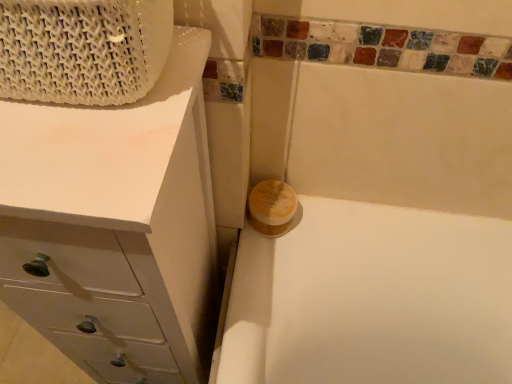
Question: Does yellow matte soap at center contain white woven basket at upper left?

Choices:
 (A) no
 (B) yes

Answer: (A)

Question: Is yellow matte soap at center positioned with its back to white woven basket at upper left?

Choices:
 (A) yes
 (B) no

Answer: (B)

Question: Is the depth of yellow matte soap at center greater than that of white woven basket at upper left?

Choices:
 (A) no
 (B) yes

Answer: (B)

Question: Is yellow matte soap at center thinner than white woven basket at upper left?

Choices:
 (A) yes
 (B) no

Answer: (A)

Question: Is yellow matte soap at center far away from white woven basket at upper left?

Choices:
 (A) no
 (B) yes

Answer: (A)

Question: Is white woven basket at upper left in front of or behind yellow matte soap at center in the image?

Choices:
 (A) front
 (B) behind

Answer: (A)

Question: From their relative heights in the image, would you say white woven basket at upper left is taller or shorter than yellow matte soap at center?

Choices:
 (A) short
 (B) tall

Answer: (B)

Question: Is white woven basket at upper left to the left or to the right of yellow matte soap at center in the image?

Choices:
 (A) right
 (B) left

Answer: (B)

Question: Is white woven basket at upper left wider or thinner than yellow matte soap at center?

Choices:
 (A) thin
 (B) wide

Answer: (B)

Question: Looking at their shapes, would you say yellow matte soap at center is wider or thinner than white woven basket at upper left?

Choices:
 (A) wide
 (B) thin

Answer: (B)

Question: Is yellow matte soap at center in front of or behind white woven basket at upper left in the image?

Choices:
 (A) front
 (B) behind

Answer: (B)

Question: From a real-world perspective, relative to white woven basket at upper left, is yellow matte soap at center vertically above or below?

Choices:
 (A) below
 (B) above

Answer: (A)

Question: From the image's perspective, relative to white woven basket at upper left, is yellow matte soap at center above or below?

Choices:
 (A) below
 (B) above

Answer: (A)

Question: Considering the positions of white woven basket at upper left and white matte chest of drawers at upper left in the image, is white woven basket at upper left bigger or smaller than white matte chest of drawers at upper left?

Choices:
 (A) small
 (B) big

Answer: (A)

Question: Considering their positions, is white woven basket at upper left located in front of or behind white matte chest of drawers at upper left?

Choices:
 (A) front
 (B) behind

Answer: (A)